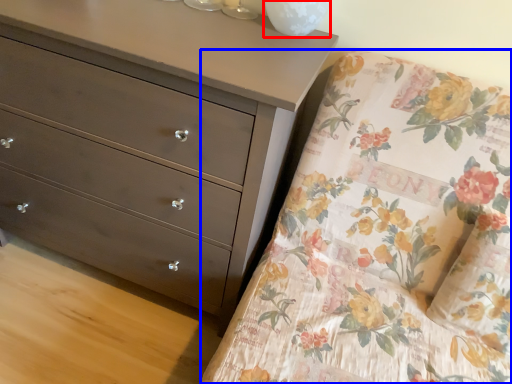
Question: Which of the following is the closest to the observer, glass vase (highlighted by a red box) or mattress (highlighted by a blue box)?

Choices:
 (A) glass vase
 (B) mattress

Answer: (B)